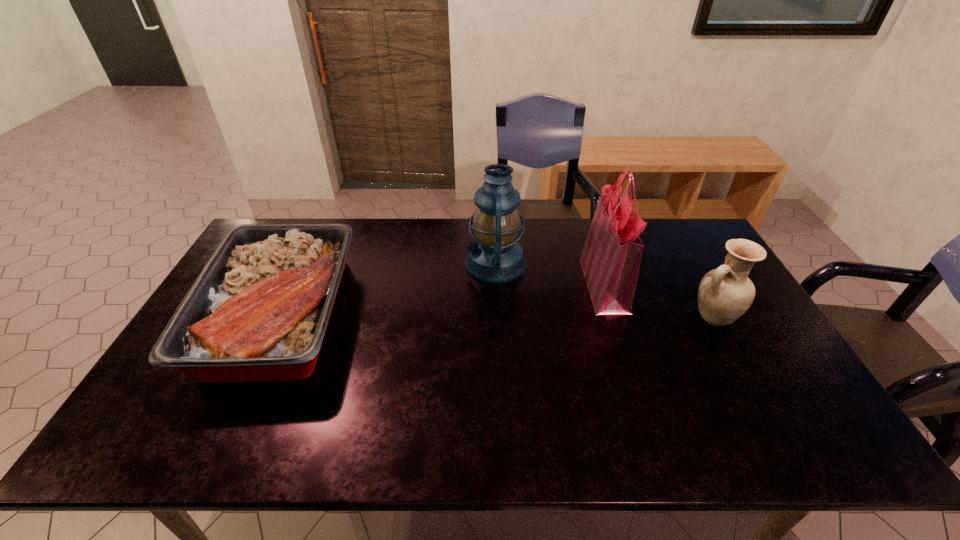
Where is `the third object from left to right`? The height and width of the screenshot is (540, 960). the third object from left to right is located at coordinates (611, 257).

In order to click on lantern in this screenshot , I will do pos(495,257).

Find the location of a particular element. the third tallest object is located at coordinates (724, 294).

Locate an element on the screen. the rightmost object is located at coordinates (724, 294).

Find the location of `tray`. tray is located at coordinates (258, 311).

Image resolution: width=960 pixels, height=540 pixels. I want to click on the leftmost object, so (258, 311).

The image size is (960, 540). Identify the location of vacant point located on the right of the third object from left to right. (710, 284).

This screenshot has width=960, height=540. I want to click on vacant area located on the face of the second object from left to right, so click(449, 264).

Where is `vacant region located on the face of the second object from left to right`? This screenshot has width=960, height=540. vacant region located on the face of the second object from left to right is located at coordinates (422, 264).

The height and width of the screenshot is (540, 960). Find the location of `free space located 0.150m on the face of the second object from left to right`. free space located 0.150m on the face of the second object from left to right is located at coordinates (419, 264).